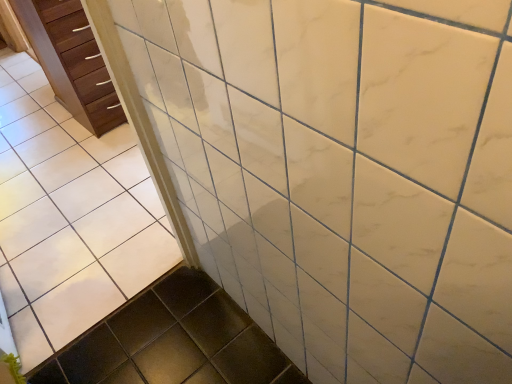
You are a GUI agent. You are given a task and a screenshot of the screen. Output one action in this format:
    pyautogui.click(x=<x>, y=<y>)
    Task: Click on the wooden chest of drawers at left
    Image resolution: width=512 pixels, height=384 pixels.
    Given the screenshot: What is the action you would take?
    point(71,61)

What is the approximate width of wooden chest of drawers at left?

wooden chest of drawers at left is 15.03 inches wide.

Image resolution: width=512 pixels, height=384 pixels. What do you see at coordinates (71, 61) in the screenshot?
I see `wooden chest of drawers at left` at bounding box center [71, 61].

From the picture: In order to face white glossy tile at upper center, should I rotate leftwards or rightwards?

Turn left approximately 26.438 degrees to face it.

You are a GUI agent. You are given a task and a screenshot of the screen. Output one action in this format:
    pyautogui.click(x=<x>, y=<y>)
    Task: Click on the white glossy tile at upper center
    The image size is (512, 384).
    Given the screenshot: What is the action you would take?
    pyautogui.click(x=69, y=217)

Measure the distance between point (25, 196) and camera.

2.23 meters.

What do you see at coordinates (69, 217) in the screenshot? The width and height of the screenshot is (512, 384). I see `white glossy tile at upper center` at bounding box center [69, 217].

At what (x,y) coordinates should I click in order to perform the action: click on wooden chest of drawers at left. Please return your answer as a coordinate pair (x, y). Image resolution: width=512 pixels, height=384 pixels. Looking at the image, I should click on (71, 61).

Considering the positions of objects wooden chest of drawers at left and white glossy tile at upper center in the image provided, who is more to the left, wooden chest of drawers at left or white glossy tile at upper center?

From the viewer's perspective, wooden chest of drawers at left appears more on the left side.

Is the depth of wooden chest of drawers at left greater than that of white glossy tile at upper center?

That is True.

Is point (36, 27) closer or farther from the camera than point (38, 199)?

Point (36, 27) appears to be closer to the viewer than point (38, 199).

From the image's perspective, is wooden chest of drawers at left on top of white glossy tile at upper center?

Yes, from the image's perspective, wooden chest of drawers at left is over white glossy tile at upper center.

From a real-world perspective, is wooden chest of drawers at left over white glossy tile at upper center?

No, from a real-world perspective, wooden chest of drawers at left is not on top of white glossy tile at upper center.

Is wooden chest of drawers at left wider or thinner than white glossy tile at upper center?

Considering their sizes, wooden chest of drawers at left looks broader than white glossy tile at upper center.

Which of these two, wooden chest of drawers at left or white glossy tile at upper center, stands taller?

white glossy tile at upper center.

Considering the relative sizes of wooden chest of drawers at left and white glossy tile at upper center in the image provided, is wooden chest of drawers at left smaller than white glossy tile at upper center?

No, wooden chest of drawers at left is not smaller than white glossy tile at upper center.

Is wooden chest of drawers at left not within white glossy tile at upper center?

Indeed, wooden chest of drawers at left is completely outside white glossy tile at upper center.

Is wooden chest of drawers at left touching white glossy tile at upper center?

There is a gap between wooden chest of drawers at left and white glossy tile at upper center.

Is wooden chest of drawers at left oriented towards white glossy tile at upper center?

No, wooden chest of drawers at left is not turned towards white glossy tile at upper center.

Can you tell me how much wooden chest of drawers at left and white glossy tile at upper center differ in facing direction?

The facing directions of wooden chest of drawers at left and white glossy tile at upper center are 178 degrees apart.

Where is `ceramic tile above the wooden chest of drawers at left (from a real-world perspective)`? ceramic tile above the wooden chest of drawers at left (from a real-world perspective) is located at coordinates (69, 217).

Between white glossy tile at upper center and wooden chest of drawers at left, which one appears on the right side from the viewer's perspective?

white glossy tile at upper center is more to the right.

Which object is closer to the camera, white glossy tile at upper center or wooden chest of drawers at left?

Positioned in front is white glossy tile at upper center.

Is point (64, 148) positioned before point (80, 7)?

No, it is not.

From the image's perspective, who appears lower, white glossy tile at upper center or wooden chest of drawers at left?

white glossy tile at upper center is shown below in the image.

From a real-world perspective, which object stands above the other?

white glossy tile at upper center is physically above.

Can you confirm if white glossy tile at upper center is thinner than wooden chest of drawers at left?

Indeed, white glossy tile at upper center has a lesser width compared to wooden chest of drawers at left.

Is white glossy tile at upper center shorter than wooden chest of drawers at left?

No.

Is white glossy tile at upper center smaller than wooden chest of drawers at left?

Yes.

From the picture: Is white glossy tile at upper center inside or outside of wooden chest of drawers at left?

white glossy tile at upper center cannot be found inside wooden chest of drawers at left.

Would you say white glossy tile at upper center is a long distance from wooden chest of drawers at left?

No, white glossy tile at upper center is not far away from wooden chest of drawers at left.

Is white glossy tile at upper center oriented away from wooden chest of drawers at left?

No.

I want to click on chest of drawers to the left of white glossy tile at upper center, so click(71, 61).

This screenshot has height=384, width=512. Find the location of `ceramic tile below the wooden chest of drawers at left (from the image's perspective)`. ceramic tile below the wooden chest of drawers at left (from the image's perspective) is located at coordinates (69, 217).

This screenshot has height=384, width=512. I want to click on the chest of drawers above the white glossy tile at upper center (from the image's perspective), so click(71, 61).